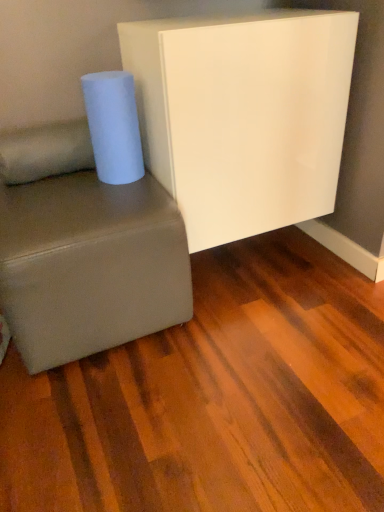
Question: From their relative heights in the image, would you say suede-like gray studio couch at lower left is taller or shorter than soft beige fabric pillow at lower left?

Choices:
 (A) short
 (B) tall

Answer: (B)

Question: Looking at the image, does suede-like gray studio couch at lower left seem bigger or smaller compared to soft beige fabric pillow at lower left?

Choices:
 (A) small
 (B) big

Answer: (B)

Question: Estimate the real-world distances between objects in this image. Which object is farther from the soft beige fabric pillow at lower left?

Choices:
 (A) white matte paper towel at left
 (B) suede-like gray studio couch at lower left
 (C) white glossy board at upper center

Answer: (C)

Question: Which object is the closest to the white glossy board at upper center?

Choices:
 (A) soft beige fabric pillow at lower left
 (B) suede-like gray studio couch at lower left
 (C) white matte paper towel at left

Answer: (C)